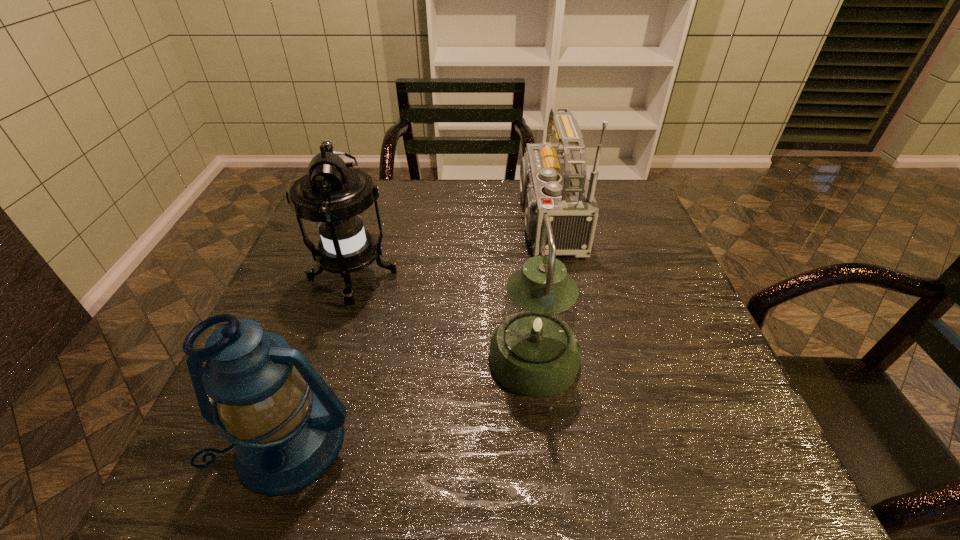
The height and width of the screenshot is (540, 960). I want to click on radio receiver, so click(553, 180).

You are a GUI agent. You are given a task and a screenshot of the screen. Output one action in this format:
    pyautogui.click(x=<x>, y=<y>)
    Task: Click on the farthest lantern
    
    Given the screenshot: What is the action you would take?
    pyautogui.click(x=334, y=196)

Locate an element on the screen. the rightmost lantern is located at coordinates (534, 353).

Where is `vacant space located on the front-facing side of the radio receiver`? This screenshot has height=540, width=960. vacant space located on the front-facing side of the radio receiver is located at coordinates (439, 221).

Locate an element on the screen. The width and height of the screenshot is (960, 540). vacant space located on the front-facing side of the radio receiver is located at coordinates (399, 221).

The width and height of the screenshot is (960, 540). What are the coordinates of `free space located on the front-facing side of the radio receiver` in the screenshot? It's located at (449, 221).

Locate an element on the screen. This screenshot has width=960, height=540. vacant space situated 0.170m on the right of the farthest lantern is located at coordinates (468, 278).

Find the location of a particular element. The image size is (960, 540). free region located 0.080m on the back of the rightmost lantern is located at coordinates (527, 299).

This screenshot has height=540, width=960. I want to click on object at the far edge, so click(553, 180).

Where is `object located at the near edge`? The height and width of the screenshot is (540, 960). object located at the near edge is located at coordinates (256, 386).